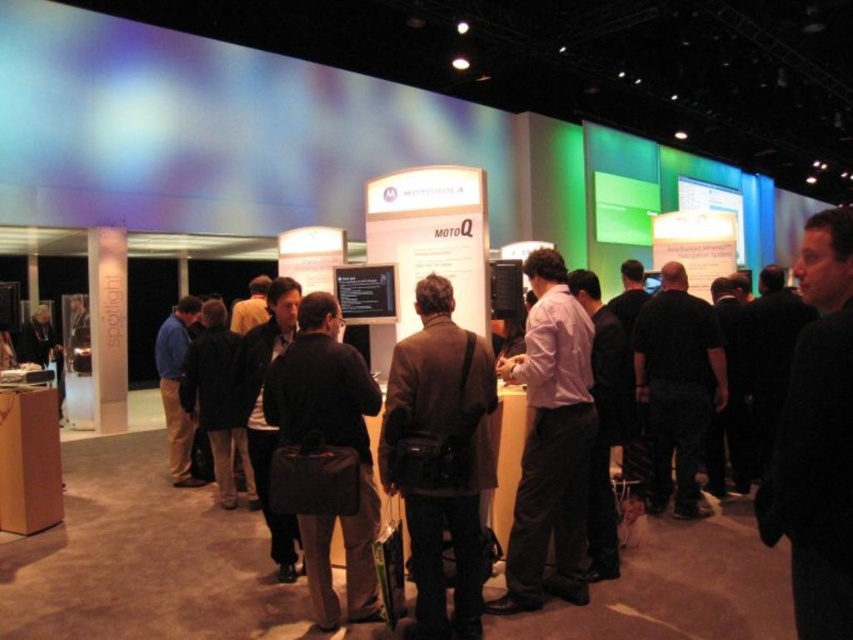
Looking at this image, you are organizing a photo shoot and need to arrange two models wearing the dark brown leather jacket at center and the purple cotton shirt at center. Since you want them to appear balanced in the frame, which model should stand closer to the camera to compensate for their height difference?

The dark brown leather jacket at center is not as tall as the purple cotton shirt at center, so the model wearing the dark brown leather jacket at center should stand closer to the camera to appear taller and create a balanced composition.

You are navigating through the event space and want to move from the MOTOQ booth to the exit located at point B. There are two points of interest marked on your map as point A at coordinates point (349, 371) and point B at coordinates point (576, 346). Which point should you head towards first to reach the exit efficiently?

Point A at coordinates point (349, 371) is in front of point B at coordinates point (576, 346), so you should head towards point A first to reach the exit efficiently.